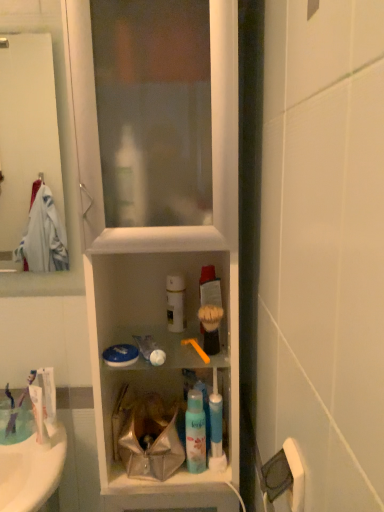
Question: From the image's perspective, is translucent plastic mouthwash at center located above white matte toothpaste at lower left, the 1th toothpaste when ordered from front to back?

Choices:
 (A) yes
 (B) no

Answer: (B)

Question: Does translucent plastic mouthwash at center have a smaller size compared to white matte toothpaste at lower left, which appears as the second toothpaste when viewed from the back?

Choices:
 (A) yes
 (B) no

Answer: (B)

Question: From the image's perspective, would you say translucent plastic mouthwash at center is shown under white matte toothpaste at lower left, which appears as the second toothpaste when viewed from the back?

Choices:
 (A) no
 (B) yes

Answer: (B)

Question: Does translucent plastic mouthwash at center appear on the right side of white matte toothpaste at lower left, the 1th toothpaste when ordered from front to back?

Choices:
 (A) yes
 (B) no

Answer: (A)

Question: Considering the relative sizes of translucent plastic mouthwash at center and white matte toothpaste at lower left, the 1th toothpaste when ordered from front to back, in the image provided, is translucent plastic mouthwash at center wider than white matte toothpaste at lower left, the 1th toothpaste when ordered from front to back,?

Choices:
 (A) no
 (B) yes

Answer: (A)

Question: Is translucent plastic mouthwash at center bigger or smaller than white glossy towel at upper left?

Choices:
 (A) big
 (B) small

Answer: (B)

Question: Considering their positions, is translucent plastic mouthwash at center located in front of or behind white glossy towel at upper left?

Choices:
 (A) front
 (B) behind

Answer: (A)

Question: From a real-world perspective, is translucent plastic mouthwash at center above or below white glossy towel at upper left?

Choices:
 (A) below
 (B) above

Answer: (A)

Question: From the image's perspective, is translucent plastic mouthwash at center located above or below white glossy towel at upper left?

Choices:
 (A) above
 (B) below

Answer: (B)

Question: Considering the positions of point (34, 396) and point (41, 370), is point (34, 396) closer or farther from the camera than point (41, 370)?

Choices:
 (A) closer
 (B) farther

Answer: (A)

Question: Considering their positions, is white matte toothpaste at lower left, the 1th toothpaste when ordered from front to back, located in front of or behind white glossy tube at left, which is counted as the second toothpaste, starting from the front?

Choices:
 (A) behind
 (B) front

Answer: (B)

Question: Based on their positions, is white matte toothpaste at lower left, the 1th toothpaste when ordered from front to back, located to the left or right of white glossy tube at left, positioned as the 1th toothpaste in back-to-front order?

Choices:
 (A) left
 (B) right

Answer: (B)

Question: From a real-world perspective, relative to white glossy tube at left, which is counted as the second toothpaste, starting from the front, is white matte toothpaste at lower left, which appears as the second toothpaste when viewed from the back, vertically above or below?

Choices:
 (A) below
 (B) above

Answer: (A)

Question: Is white matte spray can at center bigger or smaller than translucent plastic mouthwash at center?

Choices:
 (A) small
 (B) big

Answer: (B)

Question: In terms of height, does white matte spray can at center look taller or shorter compared to translucent plastic mouthwash at center?

Choices:
 (A) short
 (B) tall

Answer: (A)